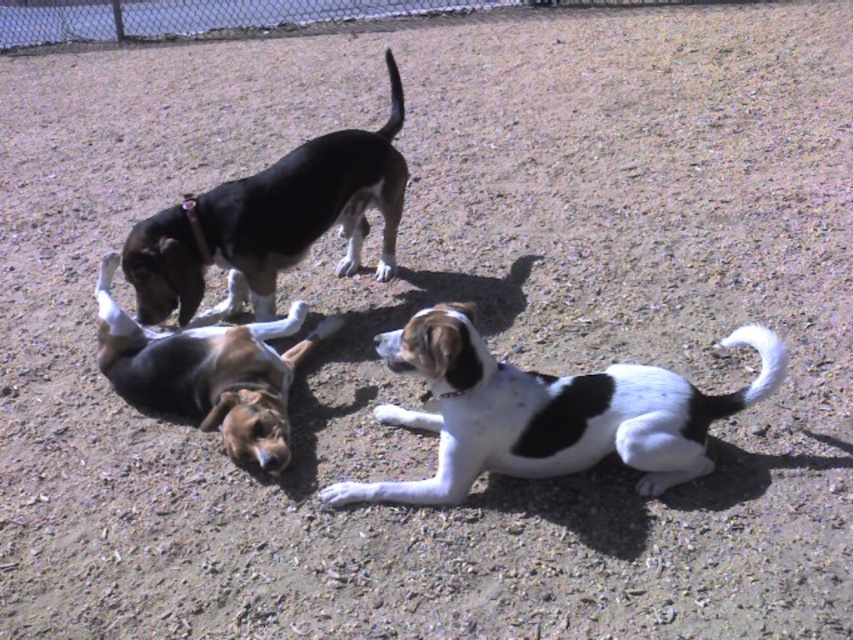
You are a dog owner trying to locate your two dogs in the park. You see the black and white fur dog at upper left and the brown and white fur dog at lower left. Which dog is closer to you?

The black and white fur dog at upper left is closer to you because it is further to the viewer than the brown and white fur dog at lower left.

You are a photographer trying to capture the black and white fur dog at upper left in the center of your photo. Given the current position of the dog at point 0.347, 0.319, will you need to move your camera to the left or right to center the dog?

The black and white fur dog at upper left is located at point (271, 221). To center it, you would need to move the camera to the left because the dog is positioned to the right of the center point.